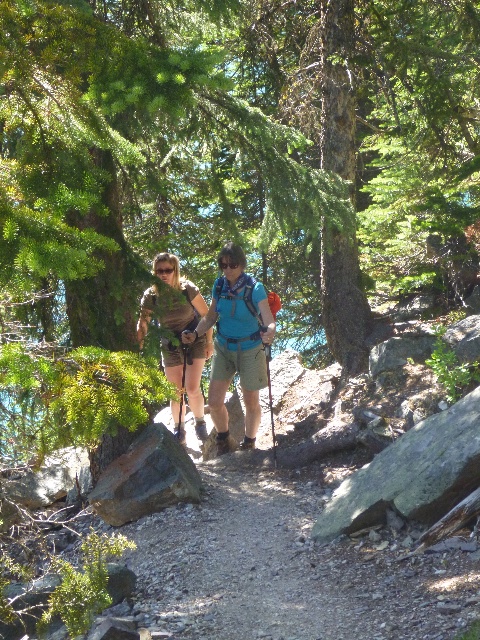
You are a drone operator trying to capture a photo of two points on the rocky trail. The first point is at coordinates point (165, 172) and the second is at point (214, 404). Which point is closer to the camera?

Point (165, 172) is further to the camera than point (214, 404), so the second point is closer to the camera.